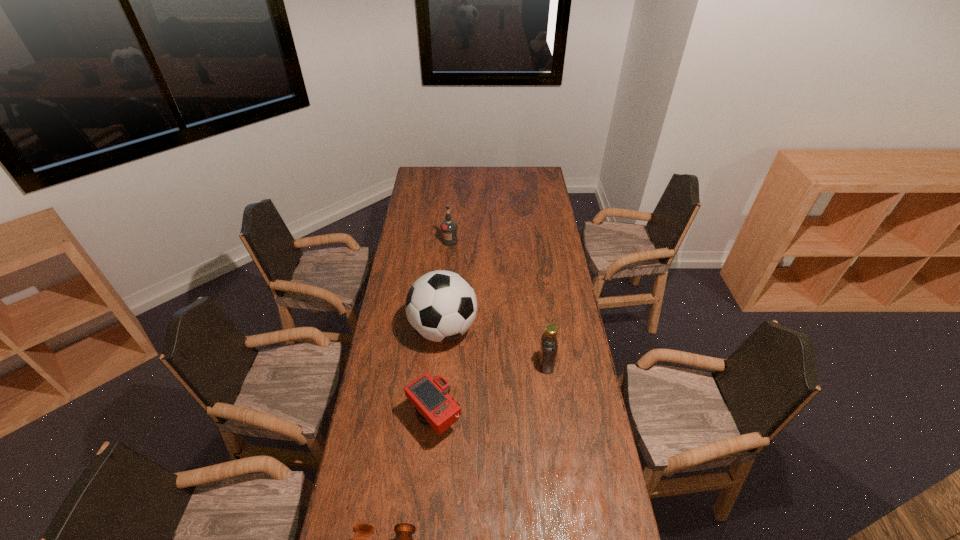
Find the location of a particular element. vacant space located 0.050m on the front-facing side of the rightmost object is located at coordinates (525, 364).

Locate an element on the screen. Image resolution: width=960 pixels, height=540 pixels. vacant region located on the right of the camera is located at coordinates (494, 419).

This screenshot has width=960, height=540. In order to click on soccer ball that is at the left edge in this screenshot , I will do `click(441, 306)`.

Locate an element on the screen. The image size is (960, 540). camera that is at the left edge is located at coordinates (434, 407).

What are the coordinates of `object located in the right edge section of the desktop` in the screenshot? It's located at (548, 349).

This screenshot has height=540, width=960. I want to click on vacant space at the far edge of the desktop, so click(451, 186).

Where is `vacant space at the left edge of the desktop`? Image resolution: width=960 pixels, height=540 pixels. vacant space at the left edge of the desktop is located at coordinates (409, 408).

I want to click on vacant space at the right edge, so click(545, 252).

The image size is (960, 540). In order to click on free region at the far left corner in this screenshot , I will do `click(426, 172)`.

What are the coordinates of `vacant point located between the second nearest object and the soccer ball` in the screenshot? It's located at (439, 374).